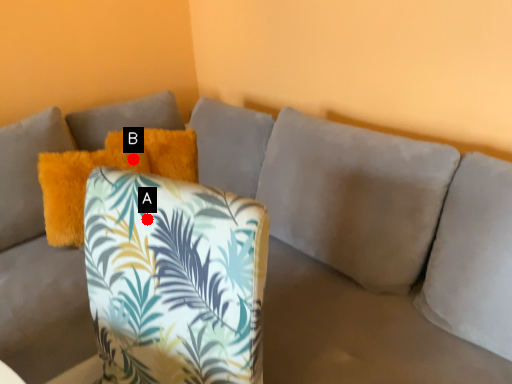
Question: Two points are circled on the image, labeled by A and B beside each circle. Which of the following is the closest to the observer?

Choices:
 (A) A is closer
 (B) B is closer

Answer: (A)